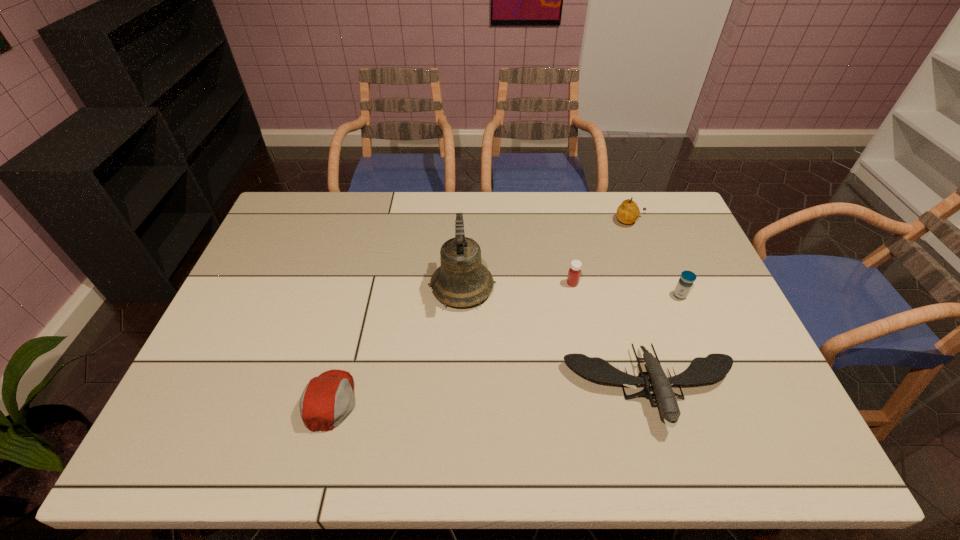
The image size is (960, 540). What are the coordinates of `object at the near right corner` in the screenshot? It's located at (715, 366).

This screenshot has height=540, width=960. I want to click on free space at the far edge, so click(x=360, y=207).

This screenshot has width=960, height=540. In order to click on free space at the left edge of the desktop in this screenshot , I will do `click(295, 244)`.

Image resolution: width=960 pixels, height=540 pixels. What are the coordinates of `free region at the right edge` in the screenshot? It's located at (673, 276).

Locate an element on the screen. Image resolution: width=960 pixels, height=540 pixels. vacant space at the far left corner of the desktop is located at coordinates (319, 215).

The image size is (960, 540). Identify the location of free space between the drone and the second object from left to right. (557, 338).

This screenshot has height=540, width=960. Find the location of `empty location between the nearer medicine and the left medicine`. empty location between the nearer medicine and the left medicine is located at coordinates [626, 289].

Locate an element on the screen. This screenshot has height=540, width=960. free space between the right medicine and the bell is located at coordinates (571, 292).

Image resolution: width=960 pixels, height=540 pixels. I want to click on free spot between the fifth shortest object and the cap, so click(x=480, y=311).

Image resolution: width=960 pixels, height=540 pixels. I want to click on free space between the farther medicine and the drone, so click(612, 336).